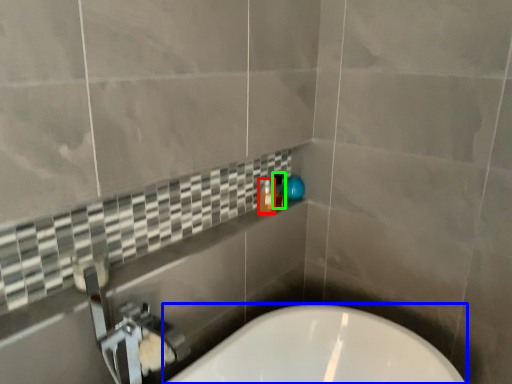
Question: Which object is the closest to the bottle (highlighted by a red box)? Choose among these: bathtub (highlighted by a blue box) or toiletry (highlighted by a green box).

Choices:
 (A) bathtub
 (B) toiletry

Answer: (B)